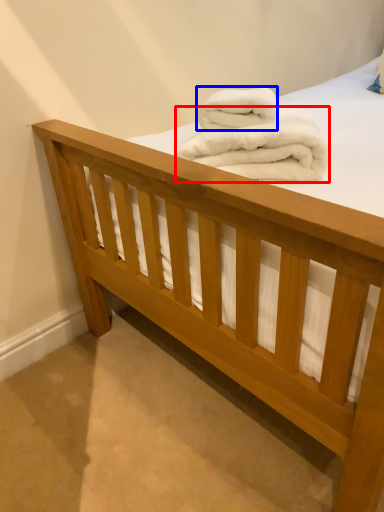
Question: Which of the following is the closest to the observer, towel (highlighted by a red box) or towel (highlighted by a blue box)?

Choices:
 (A) towel
 (B) towel

Answer: (A)